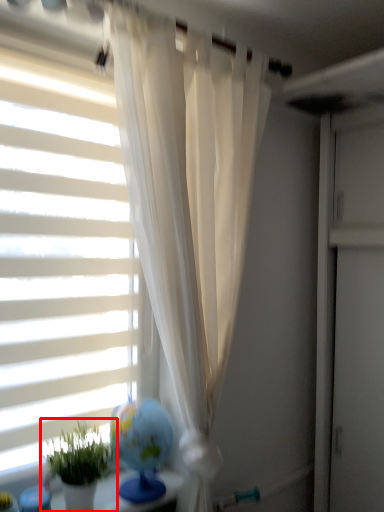
Question: From the image's perspective, what is the correct spatial positioning of houseplant (annotated by the red box) in reference to window blind?

Choices:
 (A) above
 (B) below

Answer: (B)